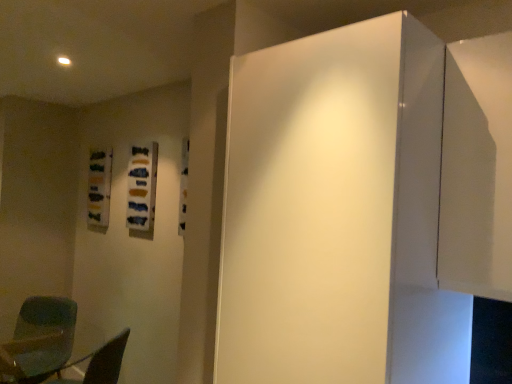
Question: Is matte green chair at lower left positioned behind transparent plastic chair at lower left?

Choices:
 (A) no
 (B) yes

Answer: (B)

Question: Considering the relative sizes of matte green chair at lower left and transparent plastic chair at lower left in the image provided, is matte green chair at lower left shorter than transparent plastic chair at lower left?

Choices:
 (A) no
 (B) yes

Answer: (A)

Question: Could you tell me if matte green chair at lower left is turned towards transparent plastic chair at lower left?

Choices:
 (A) yes
 (B) no

Answer: (B)

Question: Does matte green chair at lower left appear on the right side of transparent plastic chair at lower left?

Choices:
 (A) no
 (B) yes

Answer: (A)

Question: Is matte green chair at lower left positioned beyond the bounds of transparent plastic chair at lower left?

Choices:
 (A) no
 (B) yes

Answer: (B)

Question: Does matte green chair at lower left have a greater height compared to transparent plastic chair at lower left?

Choices:
 (A) yes
 (B) no

Answer: (A)

Question: Does transparent plastic chair at lower left appear on the left side of white glossy door at center?

Choices:
 (A) no
 (B) yes

Answer: (B)

Question: From a real-world perspective, is transparent plastic chair at lower left physically above white glossy door at center?

Choices:
 (A) yes
 (B) no

Answer: (B)

Question: Is white glossy door at center completely or partially inside transparent plastic chair at lower left?

Choices:
 (A) no
 (B) yes

Answer: (A)

Question: Can you confirm if transparent plastic chair at lower left is thinner than white glossy door at center?

Choices:
 (A) no
 (B) yes

Answer: (B)

Question: From the image's perspective, is transparent plastic chair at lower left on white glossy door at center?

Choices:
 (A) no
 (B) yes

Answer: (A)

Question: Is transparent plastic chair at lower left further to the viewer compared to white glossy door at center?

Choices:
 (A) yes
 (B) no

Answer: (A)

Question: Considering the relative sizes of matte green chair at lower left and white glossy door at center in the image provided, is matte green chair at lower left shorter than white glossy door at center?

Choices:
 (A) yes
 (B) no

Answer: (A)